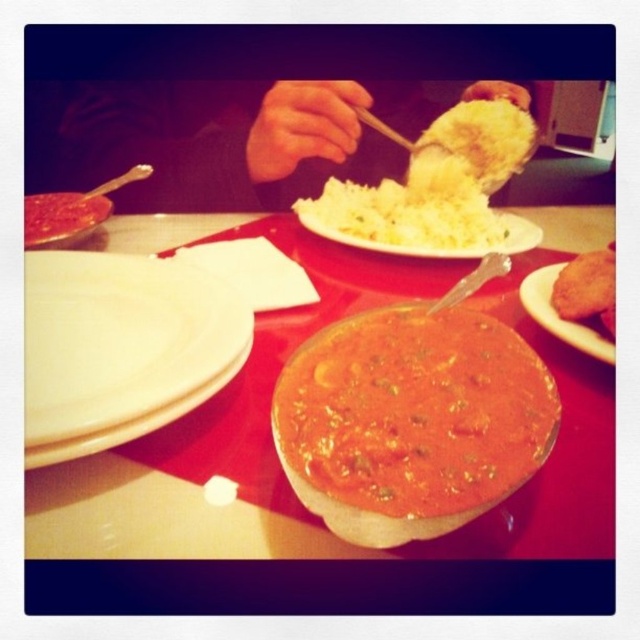
You are a chef preparing a dish and need to place both the white fluffy rice at upper center and yellow fluffy rice at upper center on a plate. The plate has a diameter of 10 inches. Can both rice portions fit on the plate without overlapping?

The white fluffy rice at upper center is 1.80 inches away from yellow fluffy rice at upper center. Since the plate has a diameter of 10 inches, which is much larger than the distance between them, both rice portions can fit on the plate without overlapping.

You are sitting at the table and want to reach for an item. There are two points marked on the tablecloth. The first point is at coordinate point(348,224) and the second is at point(460,116). Which point is closer to you?

Point(348,224) is in front of point(460,116), so it is closer to you.